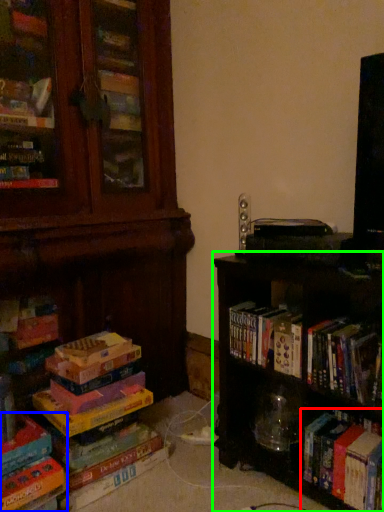
Question: Estimate the real-world distances between objects in this image. Which object is farther from book (highlighted by a red box), book (highlighted by a blue box) or shelf (highlighted by a green box)?

Choices:
 (A) book
 (B) shelf

Answer: (A)